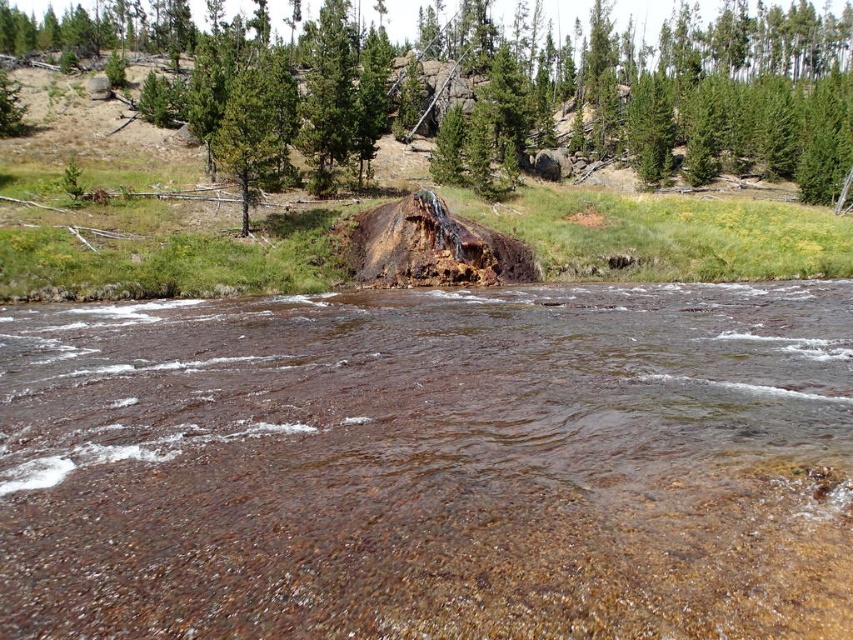
Question: Which object is the farthest from the green rough bark tree at upper center?

Choices:
 (A) clear water at center
 (B) green rough bark tree trunk at center

Answer: (A)

Question: Is clear water at center to the left of green matte tree at center from the viewer's perspective?

Choices:
 (A) yes
 (B) no

Answer: (B)

Question: Which object appears farthest from the camera in this image?

Choices:
 (A) clear water at center
 (B) green rough bark tree at upper center
 (C) green rough bark tree trunk at center

Answer: (C)

Question: Is clear water at center below green matte tree at center?

Choices:
 (A) yes
 (B) no

Answer: (A)

Question: Does clear water at center appear under green rough bark tree trunk at center?

Choices:
 (A) no
 (B) yes

Answer: (B)

Question: Which object is closer to the camera taking this photo?

Choices:
 (A) green matte tree at center
 (B) green rough bark tree at upper center
 (C) green rough bark tree trunk at center
 (D) clear water at center

Answer: (D)